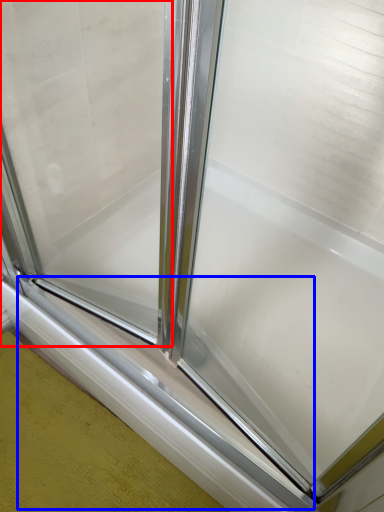
Question: Which object appears closest to the camera in this image, window screen (highlighted by a red box) or window sill (highlighted by a blue box)?

Choices:
 (A) window screen
 (B) window sill

Answer: (A)